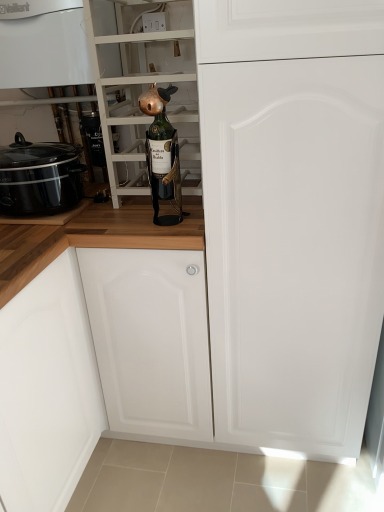
Question: Are black glossy slow cooker at left and green glass bottle at center beside each other?

Choices:
 (A) no
 (B) yes

Answer: (A)

Question: Considering the relative sizes of black glossy slow cooker at left and green glass bottle at center in the image provided, is black glossy slow cooker at left shorter than green glass bottle at center?

Choices:
 (A) no
 (B) yes

Answer: (B)

Question: From the image's perspective, is black glossy slow cooker at left located above green glass bottle at center?

Choices:
 (A) yes
 (B) no

Answer: (B)

Question: From a real-world perspective, is black glossy slow cooker at left positioned over green glass bottle at center based on gravity?

Choices:
 (A) no
 (B) yes

Answer: (A)

Question: Is green glass bottle at center completely or partially inside black glossy slow cooker at left?

Choices:
 (A) no
 (B) yes

Answer: (A)

Question: Looking at their shapes, would you say black glossy slow cooker at left is wider or thinner than white glossy boiler at upper left?

Choices:
 (A) thin
 (B) wide

Answer: (A)

Question: In the image, is black glossy slow cooker at left on the left side or the right side of white glossy boiler at upper left?

Choices:
 (A) right
 (B) left

Answer: (B)

Question: Based on their sizes in the image, would you say black glossy slow cooker at left is bigger or smaller than white glossy boiler at upper left?

Choices:
 (A) big
 (B) small

Answer: (B)

Question: From a real-world perspective, is black glossy slow cooker at left above or below white glossy boiler at upper left?

Choices:
 (A) below
 (B) above

Answer: (A)

Question: From a real-world perspective, is white matte door at center positioned above or below green glass bottle at center?

Choices:
 (A) above
 (B) below

Answer: (B)

Question: From the image's perspective, is white matte door at center located above or below green glass bottle at center?

Choices:
 (A) below
 (B) above

Answer: (A)

Question: In the image, is white matte door at center positioned in front of or behind green glass bottle at center?

Choices:
 (A) behind
 (B) front

Answer: (B)

Question: Considering the positions of white matte door at center and green glass bottle at center in the image, is white matte door at center wider or thinner than green glass bottle at center?

Choices:
 (A) thin
 (B) wide

Answer: (B)

Question: Is green glass bottle at center wider or thinner than white glossy boiler at upper left?

Choices:
 (A) thin
 (B) wide

Answer: (B)

Question: From the image's perspective, relative to white glossy boiler at upper left, is green glass bottle at center above or below?

Choices:
 (A) above
 (B) below

Answer: (B)